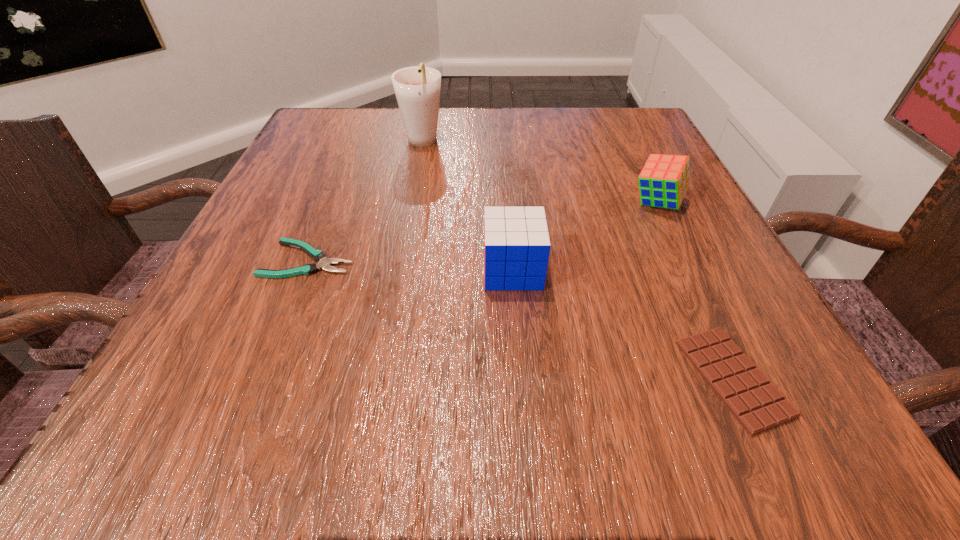
I want to click on vacant space that satisfies the following two spatial constraints: 1. on the drink side of the right cube; 2. on the right side of the root beer, so click(x=411, y=202).

Image resolution: width=960 pixels, height=540 pixels. In order to click on free space that satisfies the following two spatial constraints: 1. on the drink side of the tallest object; 2. on the right side of the third object from right to left in this screenshot , I will do `click(398, 270)`.

Locate an element on the screen. This screenshot has width=960, height=540. vacant space that satisfies the following two spatial constraints: 1. on the back side of the fourth nearest object; 2. on the right side of the third object from left to right is located at coordinates (508, 202).